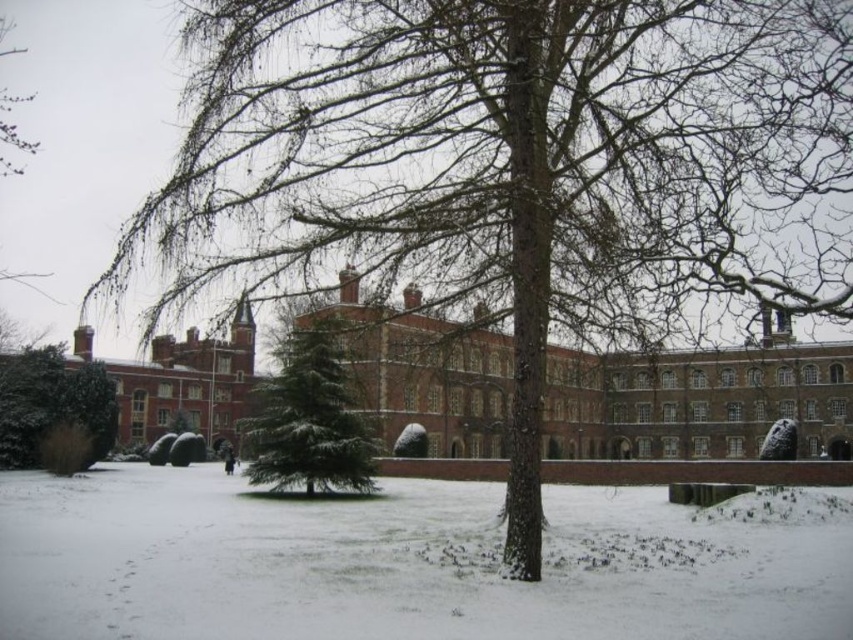
Can you confirm if green matte tree at center is positioned to the right of green matte tree at left?

Yes, green matte tree at center is to the right of green matte tree at left.

Identify the location of green matte tree at center. This screenshot has width=853, height=640. (309, 420).

Is point (352, 433) closer to viewer compared to point (91, 364)?

Yes.

Where is `green matte tree at center`? The height and width of the screenshot is (640, 853). green matte tree at center is located at coordinates (309, 420).

Between point (434, 516) and point (316, 432), which one is positioned in front?

Point (434, 516) is more forward.

You are a GUI agent. You are given a task and a screenshot of the screen. Output one action in this format:
    pyautogui.click(x=<x>, y=<y>)
    Task: Click on the white powdery snow at center
    The height and width of the screenshot is (640, 853).
    Given the screenshot: What is the action you would take?
    pyautogui.click(x=409, y=563)

The image size is (853, 640). Describe the element at coordinates (409, 563) in the screenshot. I see `white powdery snow at center` at that location.

Who is more distant from viewer, (730, 636) or (88, 458)?

Point (88, 458)

Locate an element on the screen. The width and height of the screenshot is (853, 640). white powdery snow at center is located at coordinates (409, 563).